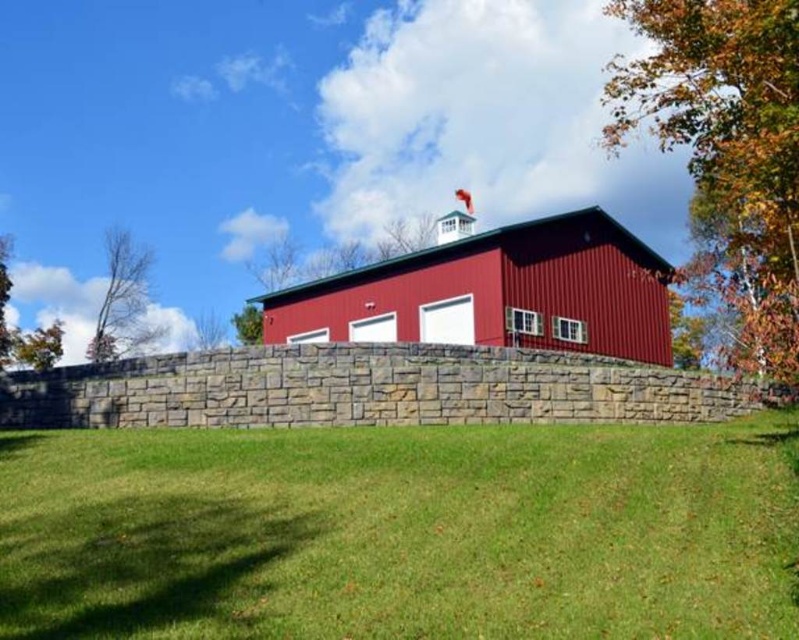
You are standing in front of the barn and want to place a small garden statue that requires a flat and level surface. Which area would be more suitable between the green grass at center and the bare branches at left?

The green grass at center is more suitable because it has lesser height compared to the bare branches at left, providing a flatter and level surface for the garden statue.

You are standing in front of the barn and want to walk from the bare branches at left to the green grass at center. Is there enough space to walk directly between them?

The green grass at center might be wider than bare branches at left, so there might be enough space to walk directly between them.

You are standing at the base of the green leafy tree at lower left and want to walk directly to the metallic red barn at center. How many steps would you need to take if each step covers approximately 3 feet?

The metallic red barn at center is 79.38 feet away from the green leafy tree at lower left. Since each step covers about 3 feet, dividing 79.38 by 3 gives approximately 26.46 steps. Therefore, you would need to take around 27 steps to reach the metallic red barn at center.